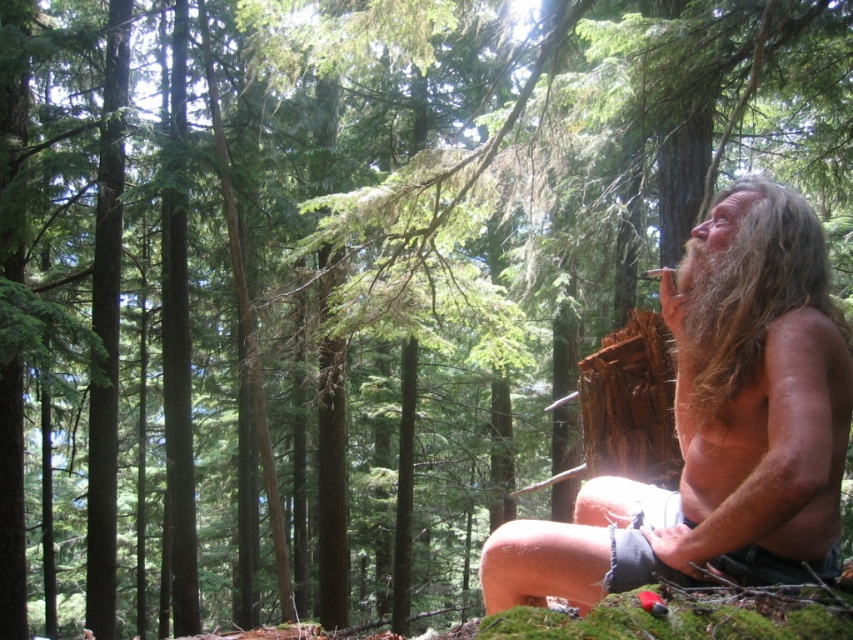
In the forest scene, there are two hair elements present. The first is the shaggy hair at right, and the second is the long brown hair at upper right. From the perspective of someone standing in the forest looking towards the man, which hair element is positioned to the left?

The shaggy hair at right is positioned to the left of the long brown hair at upper right.

Based on the scene description, which object is positioned lower between the brown wavy hair at right and the long brown hair at upper right?

The brown wavy hair at right is positioned lower than the long brown hair at upper right.